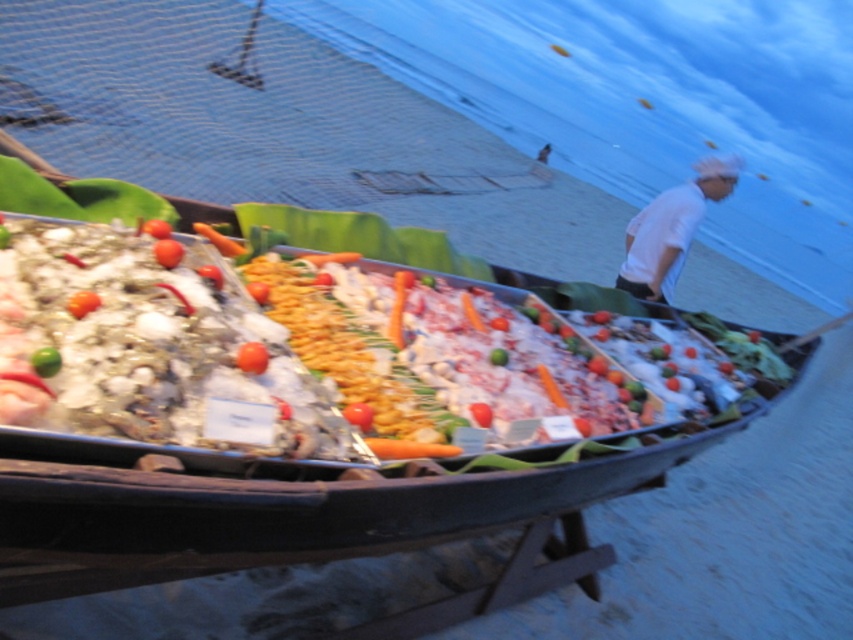
Question: Which object is the closest to the green leafy vegetable at center?

Choices:
 (A) green smooth carrot at center
 (B) red glossy tomato at center
 (C) red smooth tomato at center

Answer: (A)

Question: Which object appears closest to the camera in this image?

Choices:
 (A) red glossy tomato at center
 (B) green smooth carrot at center

Answer: (A)

Question: Does white cloth at upper right appear under green leafy vegetable at center?

Choices:
 (A) no
 (B) yes

Answer: (A)

Question: Considering the real-world distances, which object is closest to the green leafy vegetable at center?

Choices:
 (A) green matte lime at center
 (B) white cloth at upper right

Answer: (A)

Question: Can you confirm if red smooth tomato at center is positioned to the right of green matte carrot at center?

Choices:
 (A) yes
 (B) no

Answer: (A)

Question: Does red glossy tomato at center have a lesser width compared to green matte chili pepper at center?

Choices:
 (A) no
 (B) yes

Answer: (A)